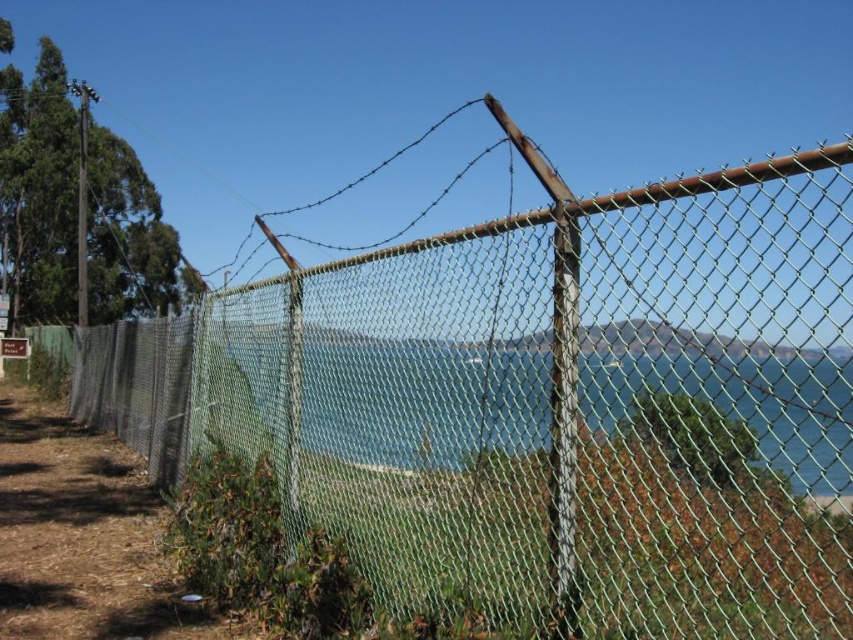
Question: Among these points, which one is farthest from the camera?

Choices:
 (A) (770, 356)
 (B) (16, 419)

Answer: (B)

Question: Considering the relative positions of green mesh fence at center and green mesh fence at lower left in the image provided, where is green mesh fence at center located with respect to green mesh fence at lower left?

Choices:
 (A) left
 (B) right

Answer: (B)

Question: Is green mesh fence at center above green mesh fence at lower left?

Choices:
 (A) no
 (B) yes

Answer: (A)

Question: Can you confirm if green mesh fence at center is positioned to the right of green mesh fence at lower left?

Choices:
 (A) yes
 (B) no

Answer: (A)